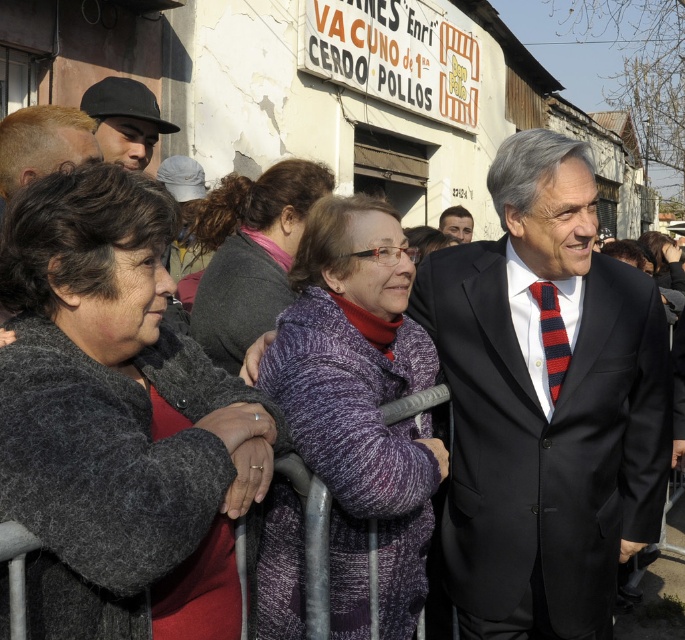
Question: Based on their relative distances, which object is farther from the dark gray sweater at center?

Choices:
 (A) black matte hat at upper left
 (B) matte black suit at center
 (C) dark gray wool sweater at left
 (D) purple knitted sweater at center

Answer: (B)

Question: Which of the following is the closest to the observer?

Choices:
 (A) (560, 369)
 (B) (421, 570)
 (C) (97, 102)
 (D) (60, 339)

Answer: (D)

Question: Observing the image, what is the correct spatial positioning of dark gray wool sweater at left in reference to dark gray sweater at center?

Choices:
 (A) left
 (B) right

Answer: (B)

Question: Can you confirm if dark gray wool sweater at left is bigger than black suit at right?

Choices:
 (A) no
 (B) yes

Answer: (A)

Question: Which of the following is the closest to the observer?

Choices:
 (A) (423, 381)
 (B) (536, 301)
 (C) (166, 419)

Answer: (C)

Question: Can you confirm if dark gray wool sweater at left is positioned to the left of purple knitted sweater at center?

Choices:
 (A) no
 (B) yes

Answer: (B)